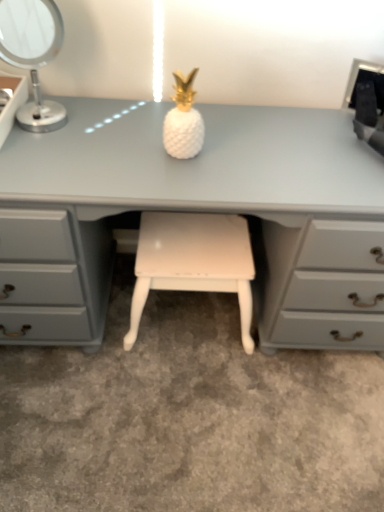
The width and height of the screenshot is (384, 512). Identify the location of free region on the left part of white glossy pineapple at center. (118, 146).